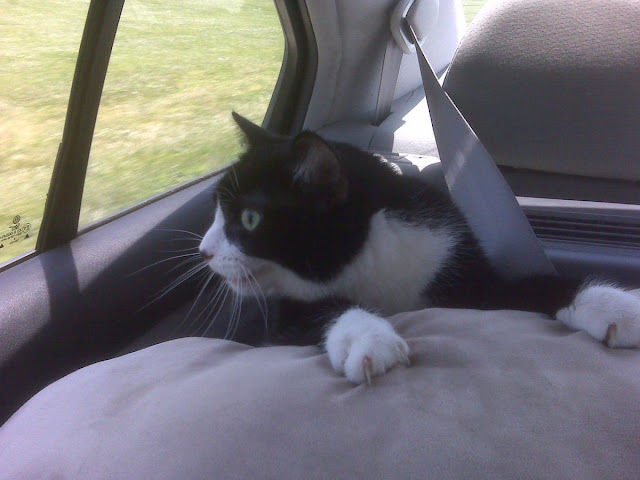
You are a GUI agent. You are given a task and a screenshot of the screen. Output one action in this format:
    pyautogui.click(x=<x>, y=<y>)
    Task: Click on the headrest
    The width and height of the screenshot is (640, 480).
    Given the screenshot: What is the action you would take?
    pyautogui.click(x=589, y=41)